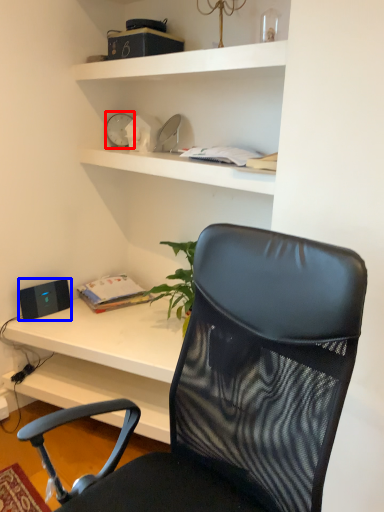
Question: Which point is further to the camera, clock (highlighted by a red box) or speaker (highlighted by a blue box)?

Choices:
 (A) clock
 (B) speaker

Answer: (A)